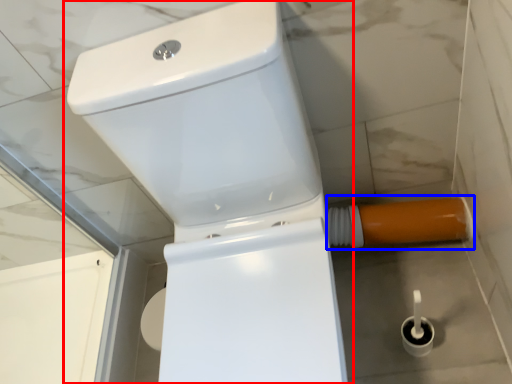
Question: Among these objects, which one is farthest to the camera, toilet (highlighted by a red box) or water pipe (highlighted by a blue box)?

Choices:
 (A) toilet
 (B) water pipe

Answer: (B)